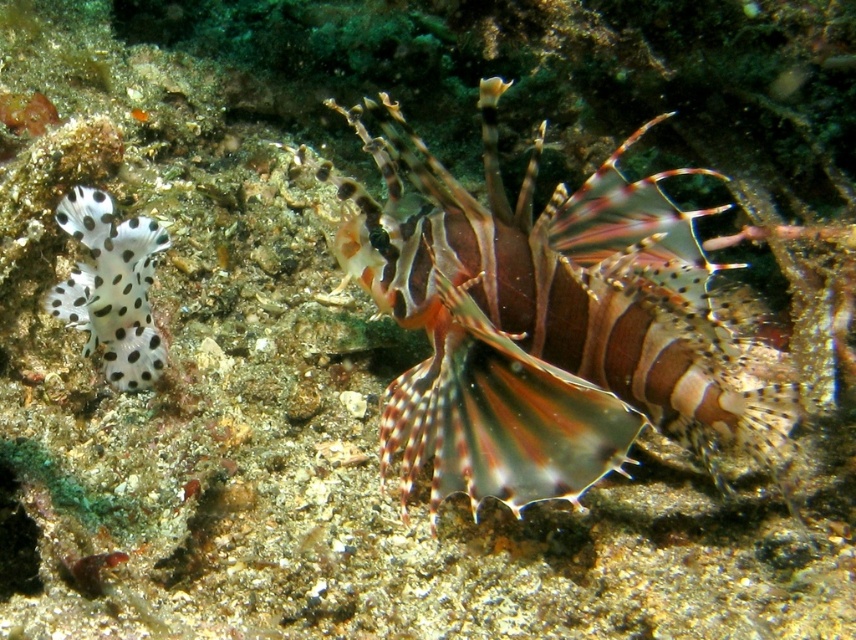
Looking at the underwater scene with the multicolored spiny fish at center and the white spotted sponge at left, which one is positioned lower in the water?

The multicolored spiny fish at center is positioned below the white spotted sponge at left, so it is lower in the water.

Looking at this image, you are a marine biologist studying underwater life. You observe a nudibranch on the left and a multicolored spiny fish at center. Based on their positions, which creature is closer to the center of the image?

The multicolored spiny fish at center is closer to the center of the image because its 2D location is at point (541, 321), which is very close to the center coordinates of (428, 320).